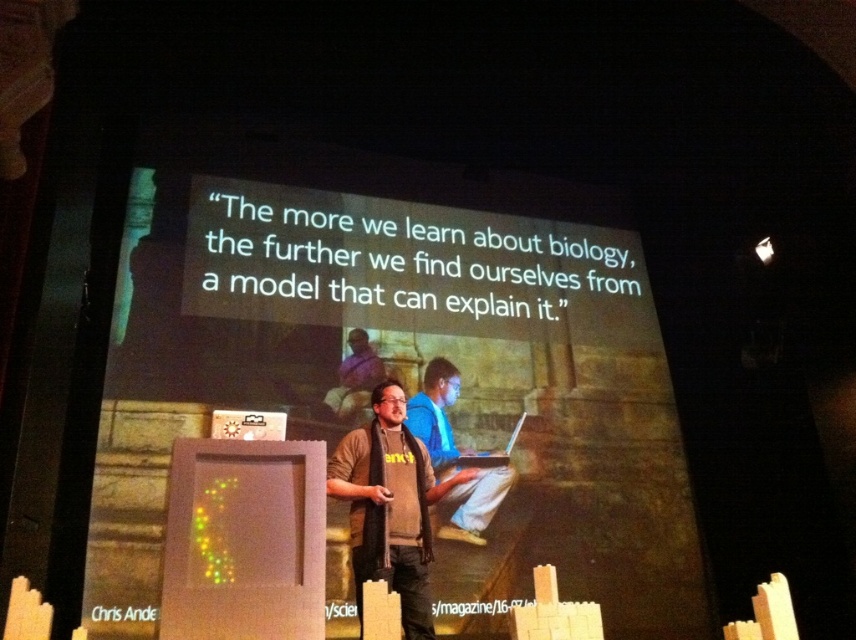
Is brown textured sweater at center to the right of blue cotton shirt at center from the viewer's perspective?

No, brown textured sweater at center is not to the right of blue cotton shirt at center.

Who is shorter, brown textured sweater at center or blue cotton shirt at center?

With less height is brown textured sweater at center.

At what (x,y) coordinates should I click in order to perform the action: click on brown textured sweater at center. Please return your answer as a coordinate pair (x, y). The width and height of the screenshot is (856, 640). Looking at the image, I should click on (390, 506).

Is blue shirt at center below matte silver laptop at center?

No.

Does point (342, 408) lie behind point (516, 426)?

That is False.

Locate an element on the screen. The height and width of the screenshot is (640, 856). blue shirt at center is located at coordinates (355, 376).

Is brown textured sweater at center in front of blue shirt at center?

Yes, it is in front of blue shirt at center.

Measure the distance between point (354, 518) and camera.

4.28 meters

Measure the distance between brown textured sweater at center and camera.

brown textured sweater at center is 13.01 feet away from camera.

This screenshot has height=640, width=856. I want to click on brown textured sweater at center, so click(390, 506).